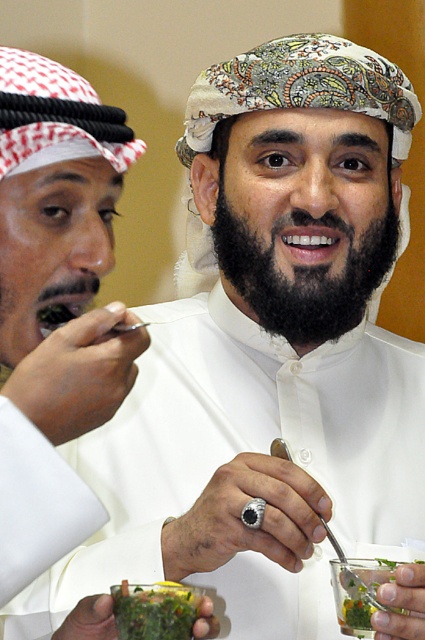
Which is more to the left, green leafy salad at center or green leafy salad at lower right?

Positioned to the left is green leafy salad at center.

Between green leafy salad at center and green leafy salad at lower right, which one is positioned higher?

green leafy salad at center is above.

Locate an element on the screen. The width and height of the screenshot is (425, 640). green leafy salad at center is located at coordinates (155, 609).

Find the location of `green leafy salad at center`. green leafy salad at center is located at coordinates tap(155, 609).

Can you confirm if black matte beard at center is wider than green leafy salad at lower right?

Yes, black matte beard at center is wider than green leafy salad at lower right.

Which is more to the right, black matte beard at center or green leafy salad at lower right?

Positioned to the right is green leafy salad at lower right.

The height and width of the screenshot is (640, 425). I want to click on black matte beard at center, so click(x=303, y=273).

Measure the distance between point [314,278] and camera.

1.10 meters

Is black matte beard at center above green leafy salad at center?

Indeed, black matte beard at center is positioned over green leafy salad at center.

Does point (271, 252) come farther from viewer compared to point (163, 595)?

That is True.

The image size is (425, 640). I want to click on black matte beard at center, so click(x=303, y=273).